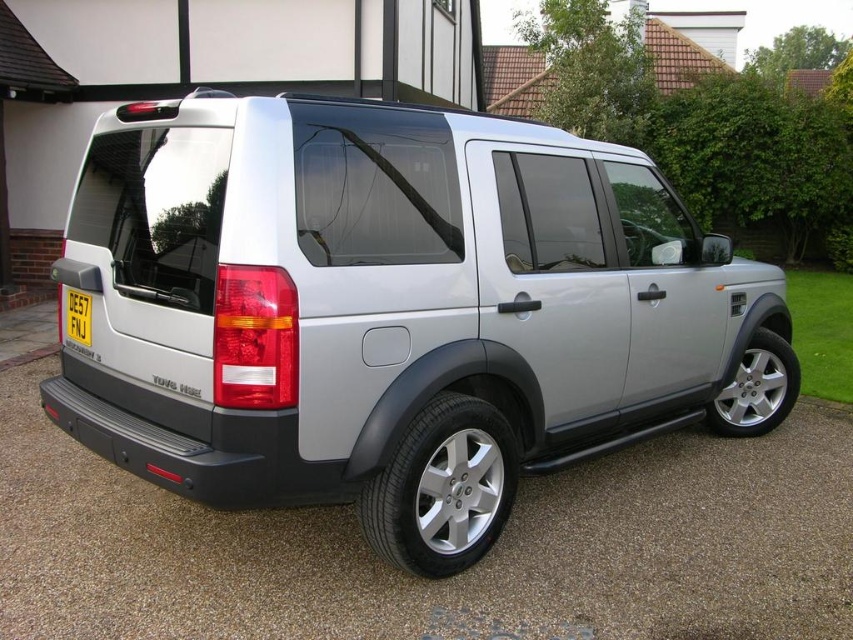
Question: Does satin silver suv at center appear over silver metallic tire at lower right?

Choices:
 (A) no
 (B) yes

Answer: (B)

Question: Considering the real-world distances, which object is closest to the satin silver suv at center?

Choices:
 (A) silver metallic tire at lower center
 (B) yellow plastic license plate at rear
 (C) silver metallic tire at lower right

Answer: (A)

Question: Which point is farther from the camera taking this photo?

Choices:
 (A) (776, 397)
 (B) (68, 308)

Answer: (A)

Question: Is gray asphalt at lower center closer to the viewer compared to yellow plastic license plate at rear?

Choices:
 (A) no
 (B) yes

Answer: (B)

Question: Is the position of satin silver suv at center less distant than that of silver metallic tire at lower center?

Choices:
 (A) no
 (B) yes

Answer: (B)

Question: Among these points, which one is nearest to the camera?

Choices:
 (A) (602, 292)
 (B) (746, 412)

Answer: (A)